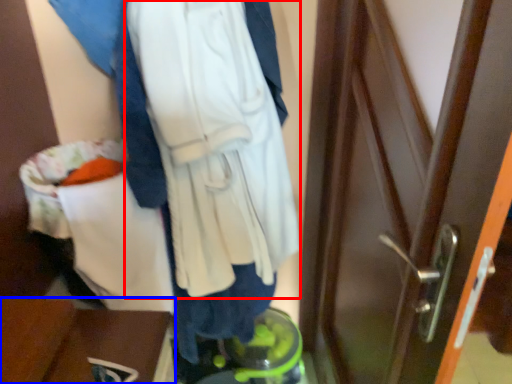
Question: Which object appears closest to the camera in this image, sweatshirt (highlighted by a red box) or furniture (highlighted by a blue box)?

Choices:
 (A) sweatshirt
 (B) furniture

Answer: (A)